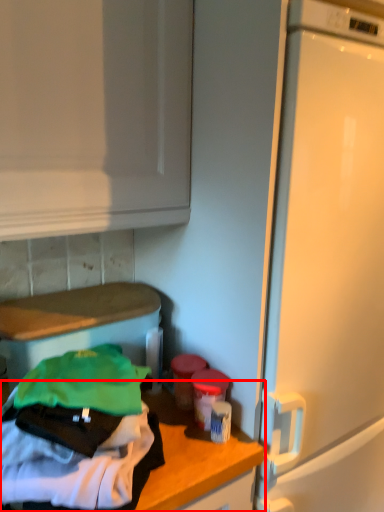
Question: Observing the image, what is the correct spatial positioning of countertop (annotated by the red box) in reference to appliance?

Choices:
 (A) right
 (B) left

Answer: (A)